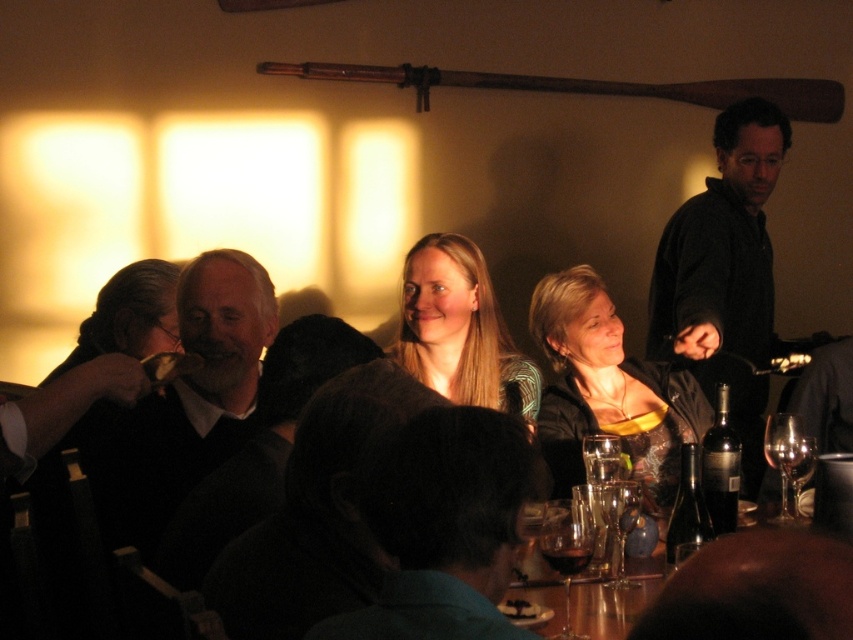
Who is shorter, dark glass bottle at center right or dark glass bottle at lower right?

Standing shorter between the two is dark glass bottle at lower right.

Is dark glass bottle at center right taller than dark glass bottle at lower right?

Correct, dark glass bottle at center right is much taller as dark glass bottle at lower right.

Image resolution: width=853 pixels, height=640 pixels. Identify the location of dark glass bottle at center right. (721, 467).

Which is below, dark gray sweater at center or clear glass wine glass at lower center?

clear glass wine glass at lower center

Does dark gray sweater at center have a greater width compared to clear glass wine glass at lower center?

Correct, the width of dark gray sweater at center exceeds that of clear glass wine glass at lower center.

Is point (155, 396) farther from camera compared to point (608, 516)?

Yes.

Find the location of a particular element. The width and height of the screenshot is (853, 640). dark gray sweater at center is located at coordinates (183, 403).

Which of these two, clear glass wine glass at lower right or transparent glass wine glass at lower right, stands taller?

clear glass wine glass at lower right is taller.

From the picture: Who is higher up, clear glass wine glass at lower right or transparent glass wine glass at lower right?

transparent glass wine glass at lower right is above.

Is point (776, 516) positioned before point (798, 472)?

No, it is not.

Locate an element on the screen. The image size is (853, 640). clear glass wine glass at lower right is located at coordinates (782, 454).